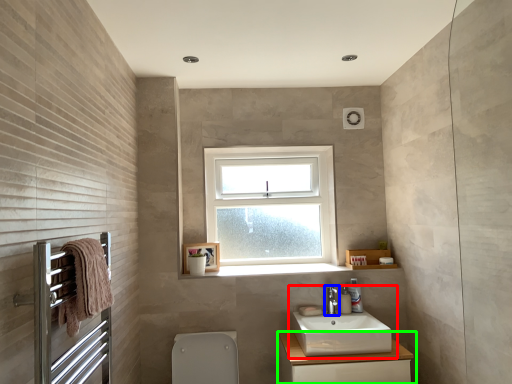
Question: Based on their relative distances, which object is nearer to sink (highlighted by a red box)? Choose from tap (highlighted by a blue box) and bathroom cabinet (highlighted by a green box).

Choices:
 (A) tap
 (B) bathroom cabinet

Answer: (B)